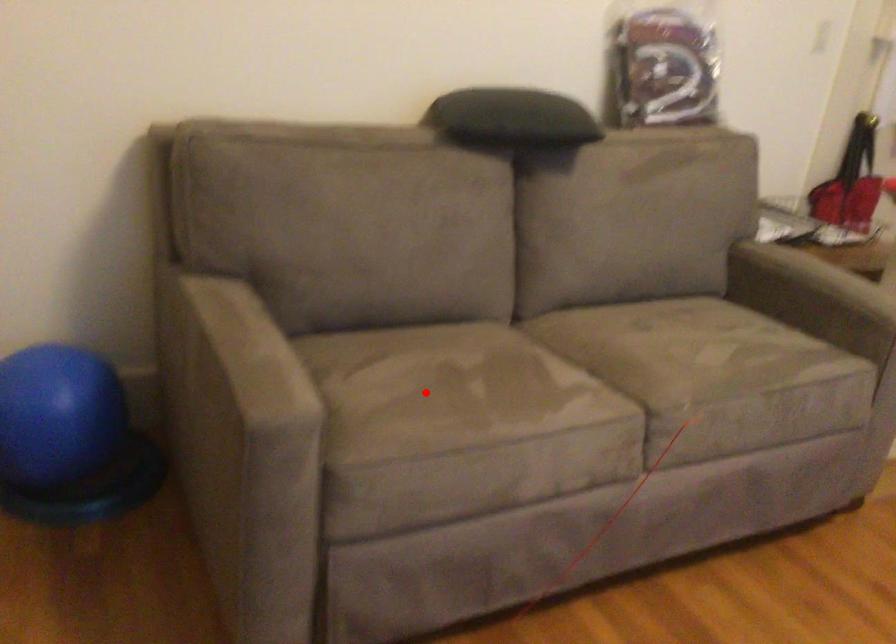
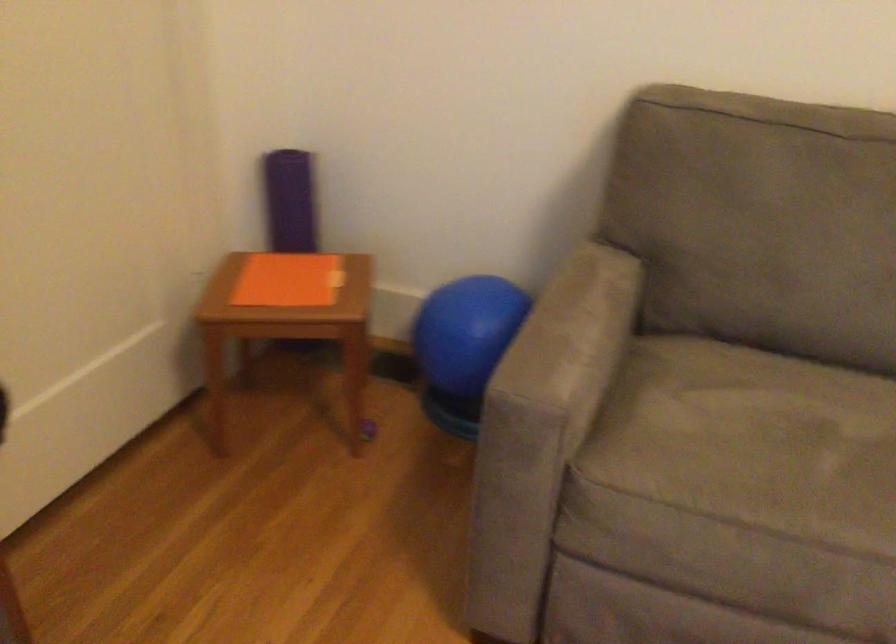
Question: I am providing you with two images of the same scene from different viewpoints. A red point is marked on the first image. Can you still see the location of the red point in image 2?

Choices:
 (A) Yes
 (B) No

Answer: (A)